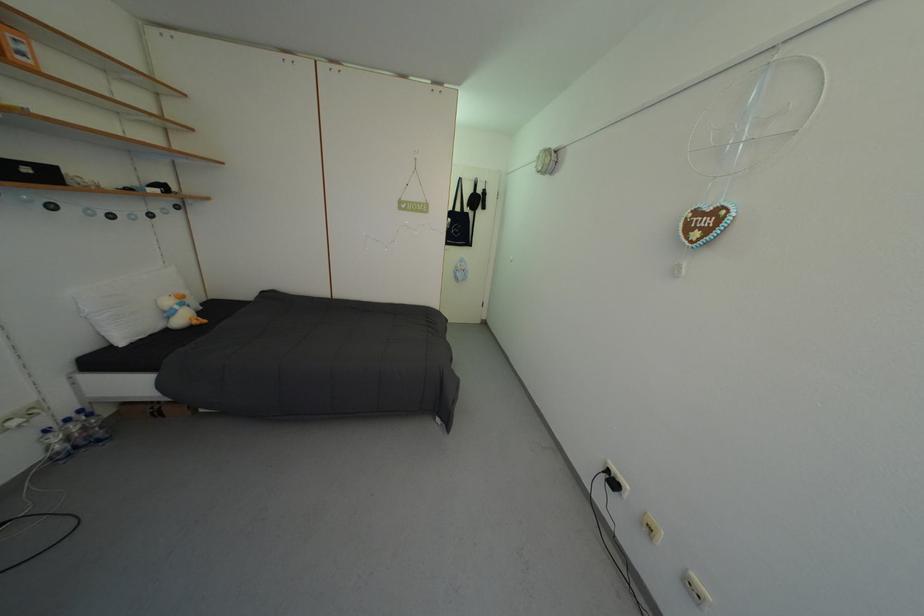
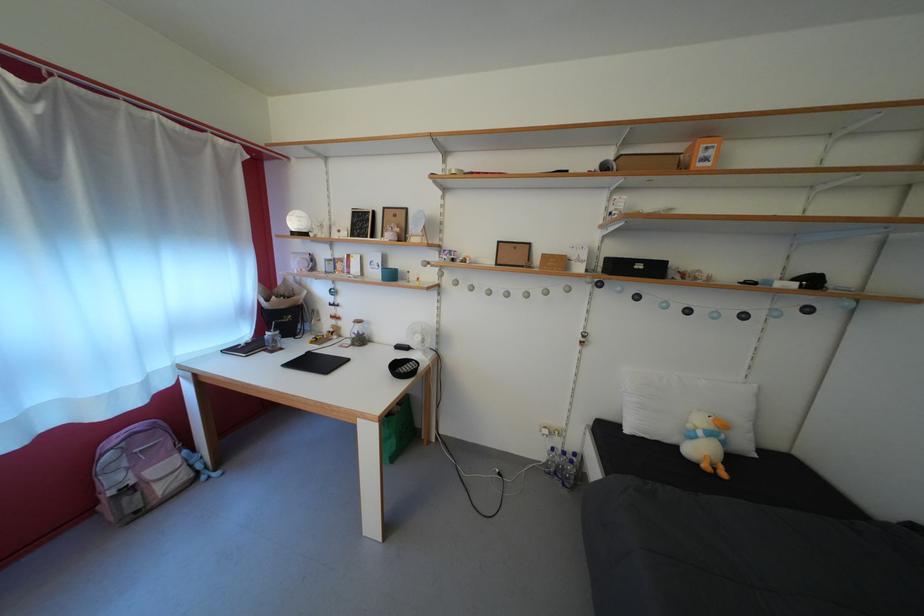
Find the pixel in the second image that matches point 55,437 in the first image.

(562, 455)